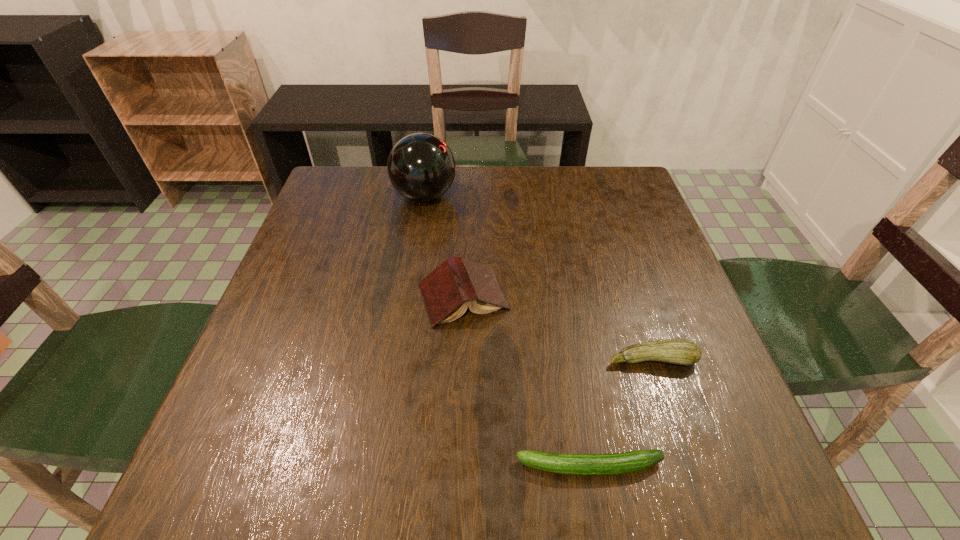
Find the location of a particular element. The height and width of the screenshot is (540, 960). the tallest object is located at coordinates (421, 167).

You are a GUI agent. You are given a task and a screenshot of the screen. Output one action in this format:
    pyautogui.click(x=<x>, y=<y>)
    Task: Click on the farthest object
    
    Given the screenshot: What is the action you would take?
    pyautogui.click(x=421, y=167)

You are a GUI agent. You are given a task and a screenshot of the screen. Output one action in this format:
    pyautogui.click(x=<x>, y=<y>)
    Task: Click on the book
    The height and width of the screenshot is (540, 960).
    Given the screenshot: What is the action you would take?
    pyautogui.click(x=457, y=283)

Identify the location of the second farthest object. (457, 283).

Identify the location of the taller zucchini. The width and height of the screenshot is (960, 540). (677, 351).

Identify the location of the second nearest object. This screenshot has height=540, width=960. (677, 351).

Locate an element on the screen. The image size is (960, 540). the nearer zucchini is located at coordinates (634, 461).

The width and height of the screenshot is (960, 540). I want to click on the nearest object, so click(634, 461).

At what (x,y) coordinates should I click in order to perform the action: click on free location located on the surface of the bowling ball near the finger holes. Please return your answer as a coordinate pair (x, y). This screenshot has width=960, height=540. Looking at the image, I should click on (542, 196).

Where is `blank area located 0.130m on the back of the book`? The height and width of the screenshot is (540, 960). blank area located 0.130m on the back of the book is located at coordinates (466, 233).